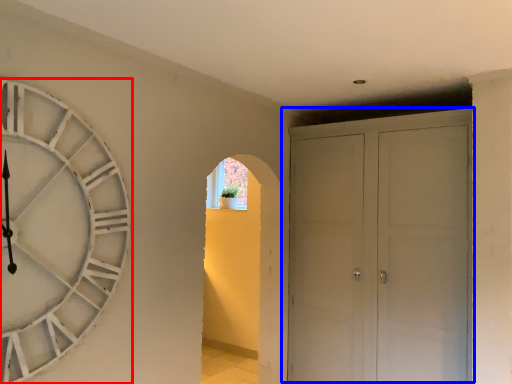
Question: Which object is closer to the camera taking this photo, wall clock (highlighted by a red box) or door (highlighted by a blue box)?

Choices:
 (A) wall clock
 (B) door

Answer: (A)